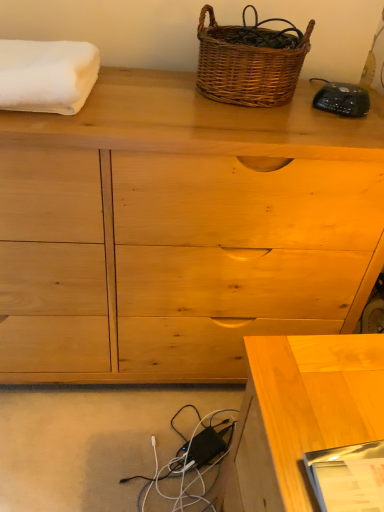
I want to click on free space to the left of black plastic remote at upper right, so click(278, 111).